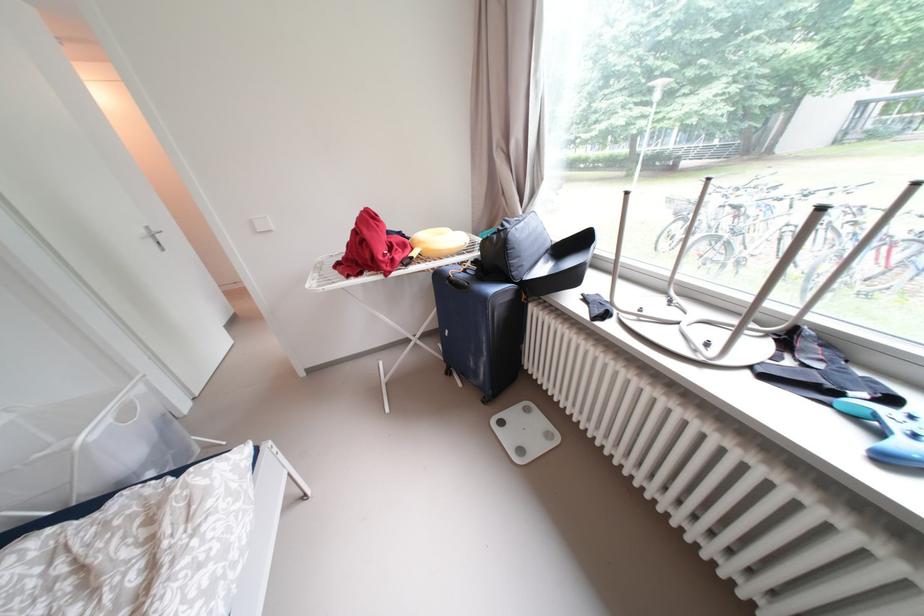
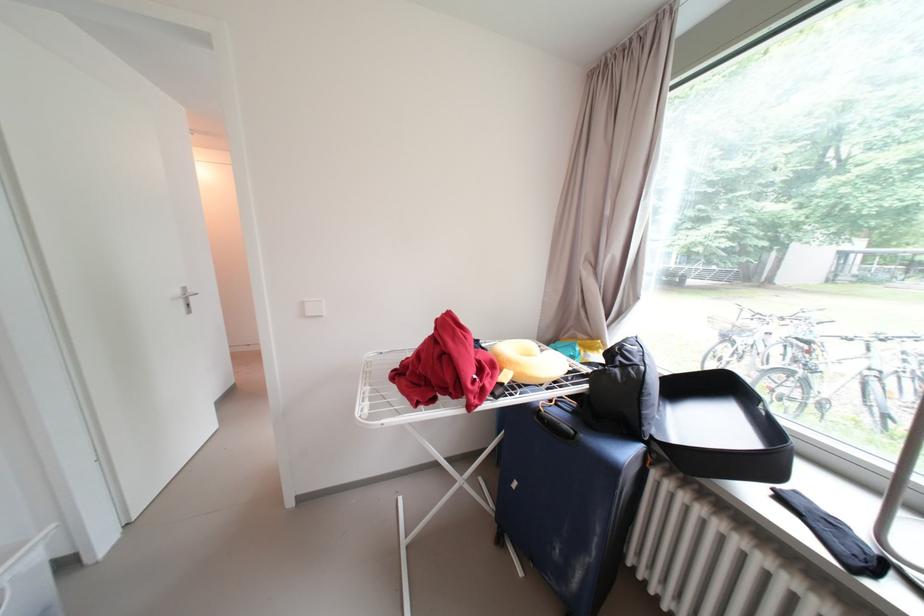
Find the pixel in the second image that matches [590,299] in the first image.

(781, 493)